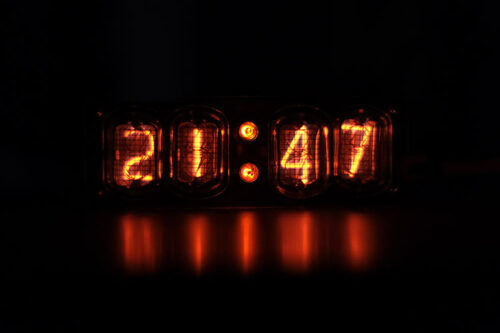
I want to click on orange led lights, so click(142, 158), click(195, 159), click(246, 169), click(302, 134), click(358, 159).